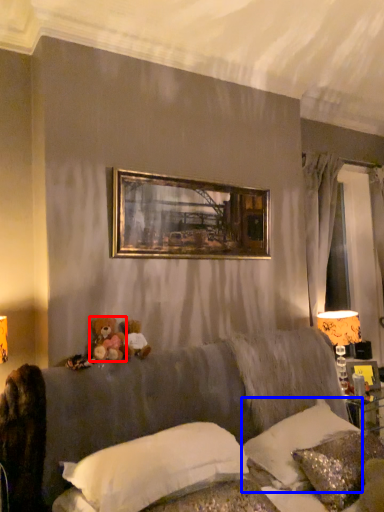
Question: Among these objects, which one is nearest to the camera, toy (highlighted by a red box) or pillow (highlighted by a blue box)?

Choices:
 (A) toy
 (B) pillow

Answer: (B)